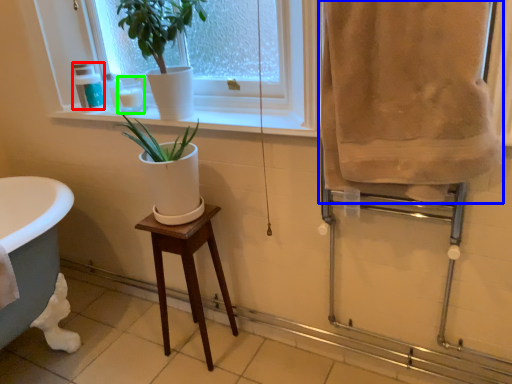
Question: Estimate the real-world distances between objects in this image. Which object is farther from toiletry (highlighted by a red box), bath towel (highlighted by a blue box) or toiletry (highlighted by a green box)?

Choices:
 (A) bath towel
 (B) toiletry

Answer: (A)